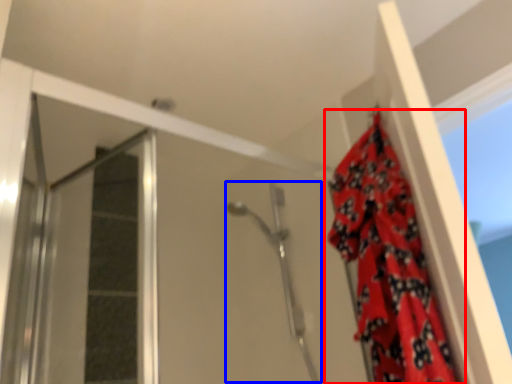
Question: Which object is closer to the camera taking this photo, curtain (highlighted by a red box) or shower (highlighted by a blue box)?

Choices:
 (A) curtain
 (B) shower

Answer: (A)